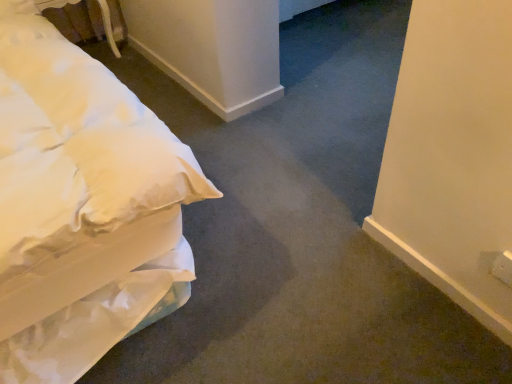
Question: In terms of size, does white fabric bed at upper left appear bigger or smaller than white soft bed at left?

Choices:
 (A) small
 (B) big

Answer: (A)

Question: From the image's perspective, is white fabric bed at upper left located above or below white soft bed at left?

Choices:
 (A) above
 (B) below

Answer: (A)

Question: From a real-world perspective, is white fabric bed at upper left above or below white soft bed at left?

Choices:
 (A) above
 (B) below

Answer: (B)

Question: From a real-world perspective, is white soft bed at left above or below white fabric bed at upper left?

Choices:
 (A) below
 (B) above

Answer: (B)

Question: In terms of size, does white soft bed at left appear bigger or smaller than white fabric bed at upper left?

Choices:
 (A) big
 (B) small

Answer: (A)

Question: Is white soft bed at left in front of or behind white fabric bed at upper left in the image?

Choices:
 (A) front
 (B) behind

Answer: (A)

Question: Visually, is white soft bed at left positioned to the left or to the right of white fabric bed at upper left?

Choices:
 (A) left
 (B) right

Answer: (B)